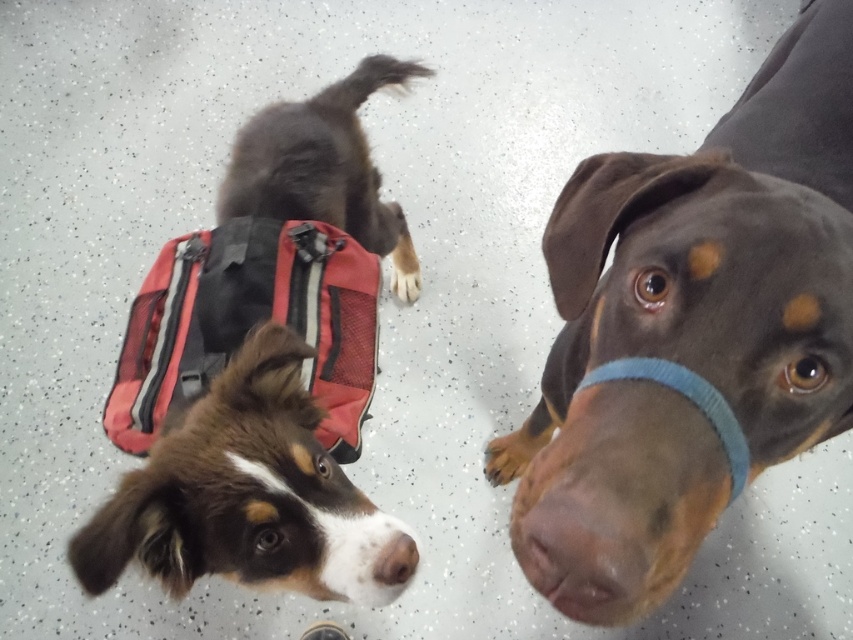
Is point (305, 532) closer to camera compared to point (250, 244)?

Yes, point (305, 532) is in front of point (250, 244).

Is brown furry dog at lower left taller than red mesh bag at upper left?

No, brown furry dog at lower left is not taller than red mesh bag at upper left.

Where is `brown furry dog at lower left`? The width and height of the screenshot is (853, 640). brown furry dog at lower left is located at coordinates (242, 493).

Between brown smooth coat at center and red mesh bag at upper left, which one appears on the right side from the viewer's perspective?

Positioned to the right is brown smooth coat at center.

Which is behind, point (604, 161) or point (335, 412)?

Positioned behind is point (335, 412).

Who is more forward, (x=660, y=477) or (x=297, y=234)?

Point (x=660, y=477)

Where is `brown smooth coat at center`? The image size is (853, 640). brown smooth coat at center is located at coordinates (689, 330).

Which is above, red mesh bag at upper left or dark brown fur at upper center?

dark brown fur at upper center is higher up.

Which is below, red mesh bag at upper left or dark brown fur at upper center?

Positioned lower is red mesh bag at upper left.

Where is `red mesh bag at upper left`? red mesh bag at upper left is located at coordinates (248, 323).